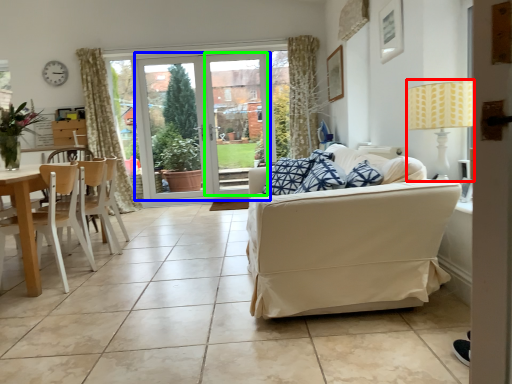
Question: Which object is the closest to the lamp (highlighted by a red box)? Choose among these: door (highlighted by a blue box) or window screen (highlighted by a green box).

Choices:
 (A) door
 (B) window screen

Answer: (B)